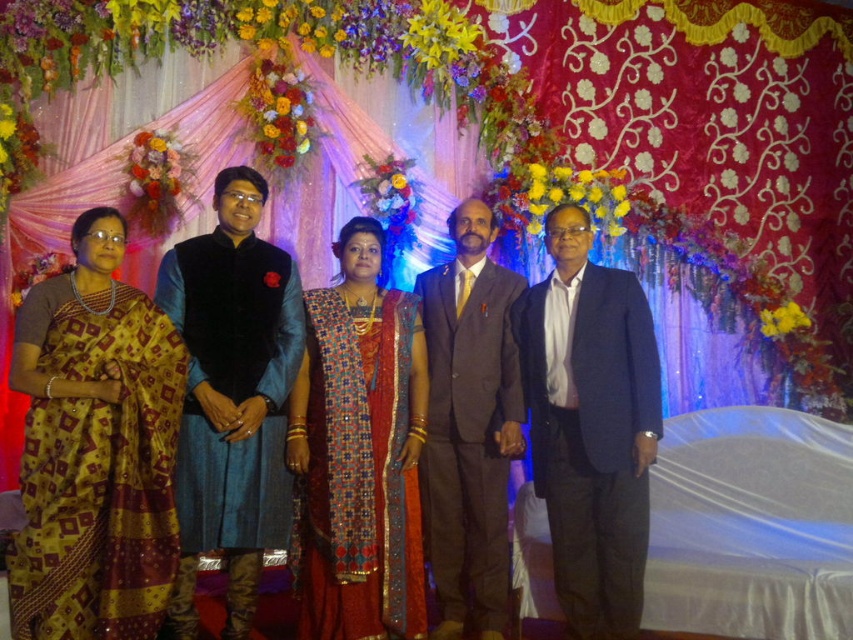
Between point (51, 429) and point (585, 636), which one is positioned in front?

Point (51, 429) is more forward.

Does point (152, 593) lie behind point (532, 300)?

No.

Image resolution: width=853 pixels, height=640 pixels. Find the location of `yellow silk saree at left`. yellow silk saree at left is located at coordinates (96, 449).

Does red silk saree at center appear on the left side of velvet blue kurta at center?

Incorrect, red silk saree at center is not on the left side of velvet blue kurta at center.

Does red silk saree at center come in front of velvet blue kurta at center?

Yes.

Between point (383, 371) and point (194, 516), which one is positioned behind?

The point (383, 371) is more distant.

I want to click on red silk saree at center, so click(358, 452).

The image size is (853, 640). What do you see at coordinates (160, 426) in the screenshot? I see `silk saree at center` at bounding box center [160, 426].

Is point (36, 403) more distant than point (160, 436)?

No.

This screenshot has height=640, width=853. What are the coordinates of `silk saree at center` in the screenshot? It's located at (160, 426).